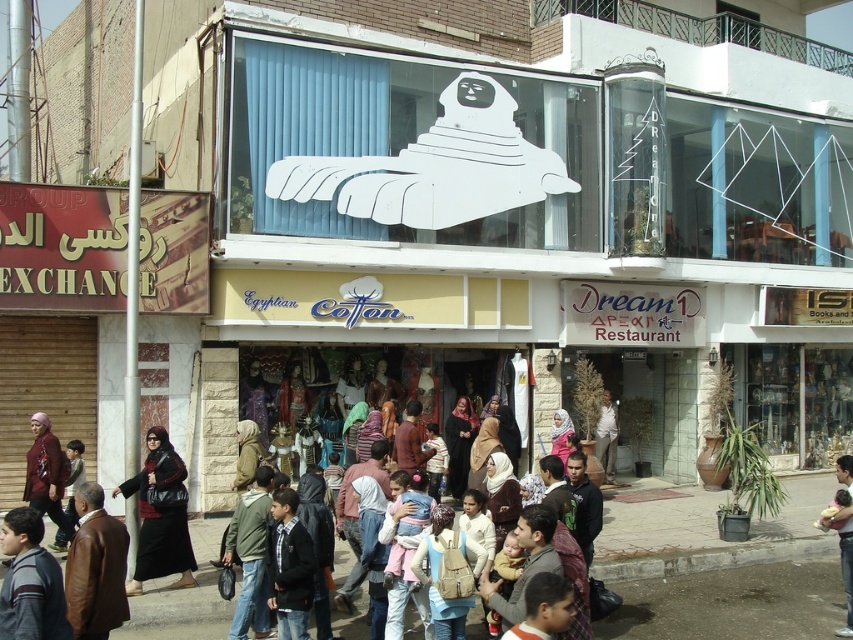
Which is in front, point (24, 513) or point (56, 480)?

Point (24, 513) is in front.

Is striped sweater at lower left closer to the viewer compared to maroon fabric hijab at center?

Yes, striped sweater at lower left is in front of maroon fabric hijab at center.

What do you see at coordinates (30, 582) in the screenshot? Image resolution: width=853 pixels, height=640 pixels. I see `striped sweater at lower left` at bounding box center [30, 582].

What are the coordinates of `striped sweater at lower left` in the screenshot? It's located at (30, 582).

Which is more to the left, brown leather jacket at lower left or striped sweater at lower left?

Positioned to the left is striped sweater at lower left.

Does point (84, 552) come farther from viewer compared to point (10, 589)?

Yes, it is behind point (10, 589).

You are a GUI agent. You are given a task and a screenshot of the screen. Output one action in this format:
    pyautogui.click(x=<x>, y=<y>)
    Task: Click on the brown leather jacket at lower left
    The width and height of the screenshot is (853, 640).
    Given the screenshot: What is the action you would take?
    pyautogui.click(x=96, y=566)

Measure the distance between black leather abaya at center and camera.

They are 33.52 feet apart.

Does point (149, 540) come behind point (848, 541)?

Yes, point (149, 540) is behind point (848, 541).

I want to click on black leather abaya at center, so click(x=160, y=516).